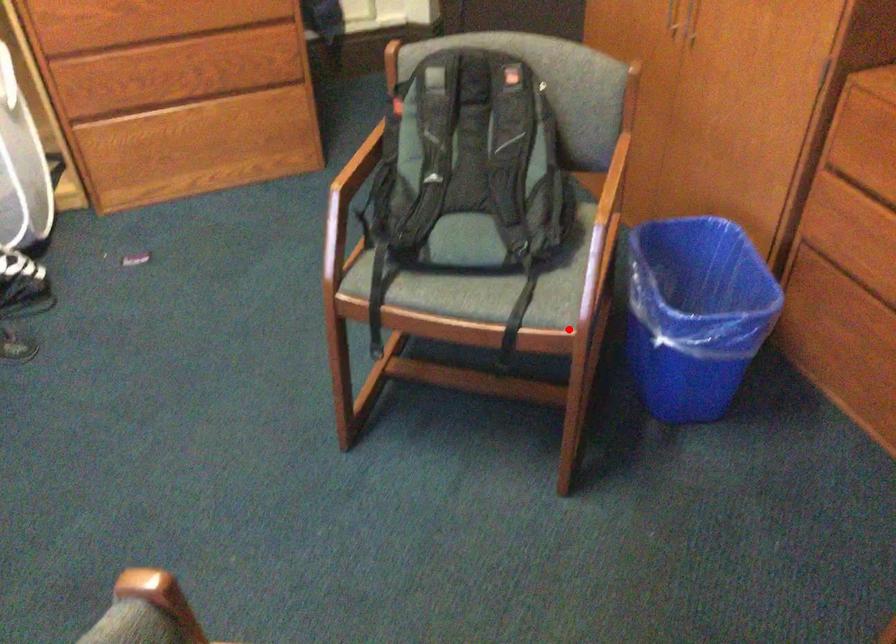
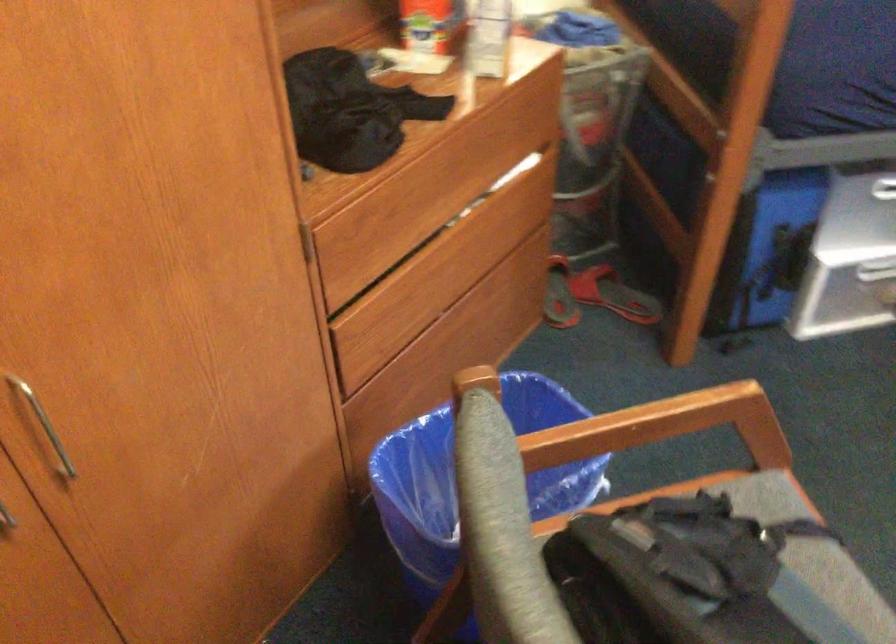
The point at the highlighted location is marked in the first image. Where is the corresponding point in the second image?

(769, 504)